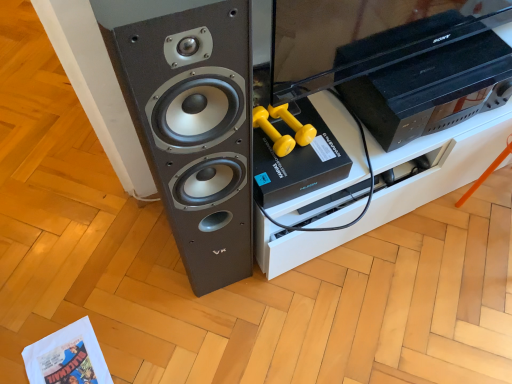
Question: Is black plastic sony tv at upper right in contact with matte black speaker at left?

Choices:
 (A) no
 (B) yes

Answer: (A)

Question: From a real-world perspective, is black plastic sony tv at upper right on top of matte black speaker at left?

Choices:
 (A) yes
 (B) no

Answer: (B)

Question: Would you say matte black speaker at left is part of black plastic sony tv at upper right's contents?

Choices:
 (A) no
 (B) yes

Answer: (A)

Question: Is black plastic sony tv at upper right smaller than matte black speaker at left?

Choices:
 (A) yes
 (B) no

Answer: (A)

Question: Is matte black speaker at left at the back of black plastic sony tv at upper right?

Choices:
 (A) yes
 (B) no

Answer: (B)

Question: Does black plastic sony tv at upper right have a lesser height compared to matte black speaker at left?

Choices:
 (A) no
 (B) yes

Answer: (B)

Question: Is matte black speaker at left next to black plastic tv stand at center and touching it?

Choices:
 (A) no
 (B) yes

Answer: (A)

Question: Is matte black speaker at left completely or partially outside of black plastic tv stand at center?

Choices:
 (A) no
 (B) yes

Answer: (B)

Question: From a real-world perspective, is matte black speaker at left located beneath black plastic tv stand at center?

Choices:
 (A) no
 (B) yes

Answer: (A)

Question: Can you confirm if matte black speaker at left is positioned to the left of black plastic tv stand at center?

Choices:
 (A) yes
 (B) no

Answer: (A)

Question: From a real-world perspective, is matte black speaker at left over black plastic tv stand at center?

Choices:
 (A) no
 (B) yes

Answer: (B)

Question: Is the depth of matte black speaker at left less than that of black plastic tv stand at center?

Choices:
 (A) yes
 (B) no

Answer: (A)

Question: Is black plastic sony tv at upper right aimed at black plastic tv stand at center?

Choices:
 (A) yes
 (B) no

Answer: (B)